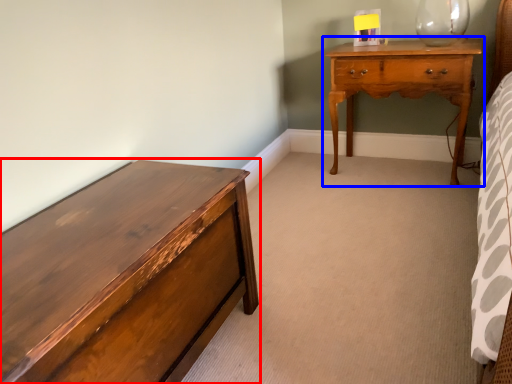
Question: Which object is closer to the camera taking this photo, chest of drawers (highlighted by a red box) or nightstand (highlighted by a blue box)?

Choices:
 (A) chest of drawers
 (B) nightstand

Answer: (A)